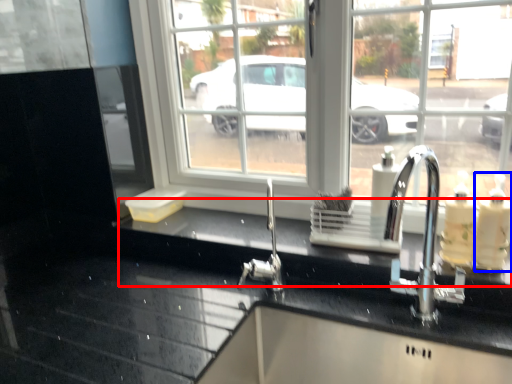
Question: Which object is closer to the camera taking this photo, counter top (highlighted by a red box) or soap dispenser (highlighted by a blue box)?

Choices:
 (A) counter top
 (B) soap dispenser

Answer: (B)